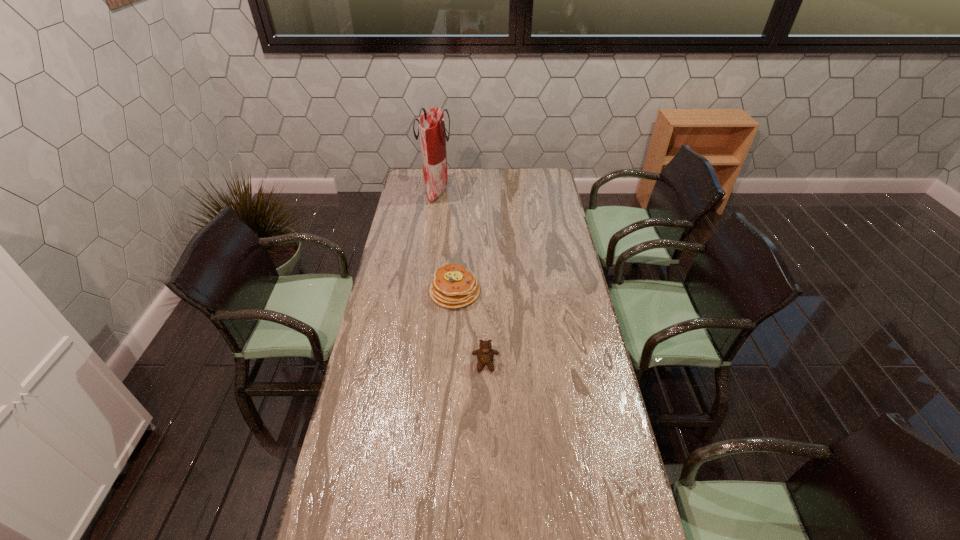
You are a GUI agent. You are given a task and a screenshot of the screen. Output one action in this format:
    pyautogui.click(x=<x>, y=<y>)
    Task: Click on the grocery bag
    The width and height of the screenshot is (960, 540).
    Given the screenshot: What is the action you would take?
    pyautogui.click(x=431, y=125)

Locate an element on the screen. the farthest object is located at coordinates (431, 125).

The image size is (960, 540). I want to click on teddy bear, so click(x=485, y=354).

Where is `pancake`? This screenshot has height=540, width=960. pancake is located at coordinates (453, 286).

Image resolution: width=960 pixels, height=540 pixels. I want to click on vacant space positioned on the front of the grocery bag, so click(x=434, y=210).

The width and height of the screenshot is (960, 540). What are the coordinates of `free spot located at the face of the nearest object` in the screenshot? It's located at (486, 417).

Where is `free spot located 0.200m on the back of the pancake`? The width and height of the screenshot is (960, 540). free spot located 0.200m on the back of the pancake is located at coordinates (458, 247).

Locate an element on the screen. object that is at the far edge is located at coordinates click(431, 125).

At what (x,y) coordinates should I click in order to perform the action: click on object situated at the left edge. Please return your answer as a coordinate pair (x, y). This screenshot has height=540, width=960. Looking at the image, I should click on (431, 125).

The width and height of the screenshot is (960, 540). I want to click on object positioned at the far left corner, so click(431, 125).